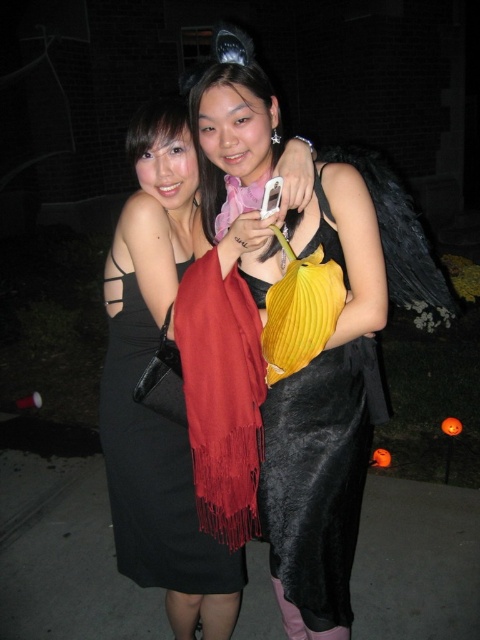
You are standing at a distance of 5 feet from the point marked at coordinates point (302,604). Can you confirm if you are closer or farther away from that point compared to the actual distance provided?

The distance of point (302,604) from viewer is 5.22 feet, so you are slightly farther away from the point since 5 feet is less than 5.22 feet.

You are a photographer trying to place a decorative light at the point marked by coordinates point (317, 483) in the image. The scene has a velvet black dress at center. Will the light be placed on the velvet black dress at center?

Yes, the point (317, 483) is on the velvet black dress at center, so placing the decorative light there will position it directly on the dress.

You are organizing a charity event and need to decide which dress to display in a small showcase. Given that the velvet black dress at center is larger than the black satin dress at center, which dress would require more space in the showcase?

The velvet black dress at center requires more space in the showcase because it has a larger size compared to the black satin dress at center.